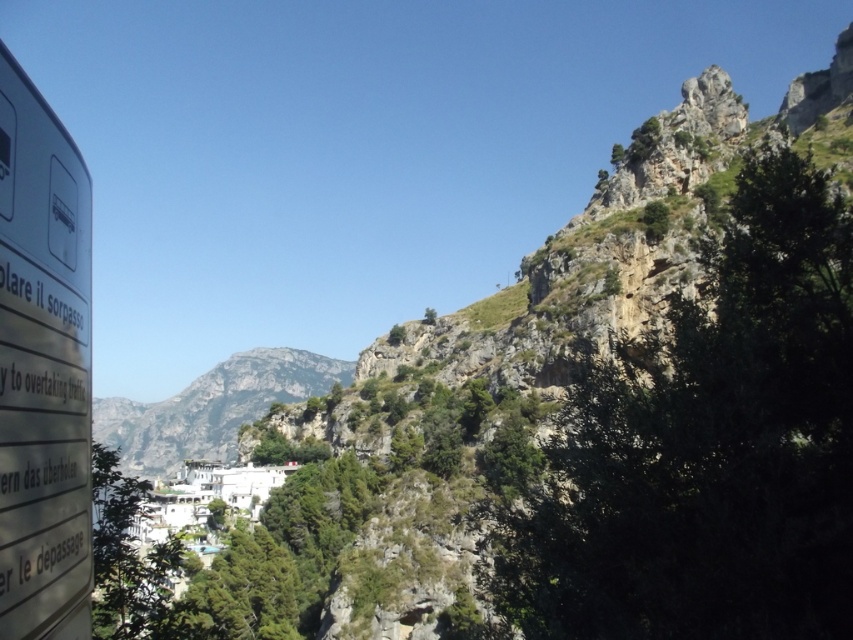
Does white plastic sign at left have a smaller size compared to gray rocky mountain at center?

Yes.

This screenshot has height=640, width=853. Identify the location of white plastic sign at left. (42, 368).

Locate an element on the screen. white plastic sign at left is located at coordinates (42, 368).

The width and height of the screenshot is (853, 640). In order to click on white plastic sign at left in this screenshot , I will do `click(42, 368)`.